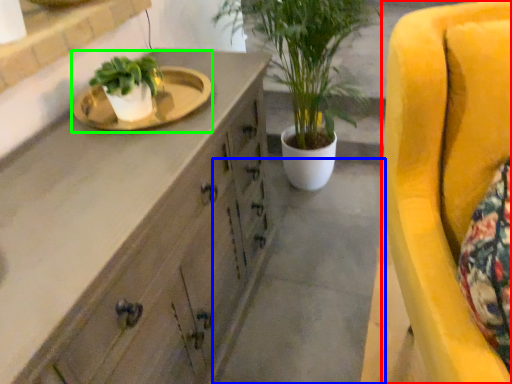
Question: Based on their relative distances, which object is farther from chair (highlighted by a red box)? Choose from concrete (highlighted by a blue box) and sink (highlighted by a green box).

Choices:
 (A) concrete
 (B) sink

Answer: (A)